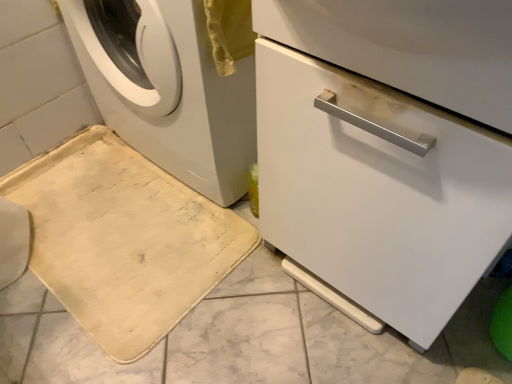
Locate an element on the screen. This screenshot has height=384, width=512. white matte washing machine at left is located at coordinates (168, 89).

From a real-world perspective, between beige fabric bath mat at lower left and white glossy dishwasher at center, who is vertically lower?

beige fabric bath mat at lower left.

Between beige fabric bath mat at lower left and white glossy dishwasher at center, which one is positioned behind?

beige fabric bath mat at lower left.

Based on the photo, is beige fabric bath mat at lower left to the left of white glossy dishwasher at center from the viewer's perspective?

Yes, beige fabric bath mat at lower left is to the left of white glossy dishwasher at center.

Is beige fabric bath mat at lower left completely or partially outside of white glossy dishwasher at center?

Yes, beige fabric bath mat at lower left is not within white glossy dishwasher at center.

This screenshot has width=512, height=384. Identify the location of washing machine that appears above the beige fabric bath mat at lower left (from the image's perspective). (168, 89).

From a real-world perspective, relative to beige fabric bath mat at lower left, is white matte washing machine at left vertically above or below?

In terms of real-world spatial position, white matte washing machine at left is above beige fabric bath mat at lower left.

In the image, is white matte washing machine at left on the left side or the right side of beige fabric bath mat at lower left?

From the image, it's evident that white matte washing machine at left is to the right of beige fabric bath mat at lower left.

From the image's perspective, between beige fabric bath mat at lower left and white matte washing machine at left, which one is located above?

white matte washing machine at left.

From a real-world perspective, between beige fabric bath mat at lower left and white matte washing machine at left, who is vertically lower?

beige fabric bath mat at lower left, from a real-world perspective.

Identify the location of washing machine that is in front of the beige fabric bath mat at lower left. Image resolution: width=512 pixels, height=384 pixels. (168, 89).

Based on the photo, is beige fabric bath mat at lower left situated inside white matte washing machine at left or outside?

beige fabric bath mat at lower left is located beyond the bounds of white matte washing machine at left.

Consider the image. Can you confirm if white matte washing machine at left is wider than white glossy dishwasher at center?

Yes.

Identify the location of machine that appears in front of the white matte washing machine at left. (387, 150).

Considering the relative positions of white matte washing machine at left and white glossy dishwasher at center in the image provided, is white matte washing machine at left to the left or to the right of white glossy dishwasher at center?

Clearly, white matte washing machine at left is on the left of white glossy dishwasher at center in the image.

Is there a large distance between white matte washing machine at left and white glossy dishwasher at center?

white matte washing machine at left is near white glossy dishwasher at center, not far away.

Is white glossy dishwasher at center not inside beige fabric bath mat at lower left?

That's correct, white glossy dishwasher at center is outside of beige fabric bath mat at lower left.

Is there a large distance between white glossy dishwasher at center and beige fabric bath mat at lower left?

They are positioned close to each other.

Does point (378, 276) come closer to viewer compared to point (29, 210)?

Yes, it is.

Is white glossy dishwasher at center wider than beige fabric bath mat at lower left?

Incorrect, the width of white glossy dishwasher at center does not surpass that of beige fabric bath mat at lower left.

Is white glossy dishwasher at center to the left of white matte washing machine at left from the viewer's perspective?

Incorrect, white glossy dishwasher at center is not on the left side of white matte washing machine at left.

Is white matte washing machine at left located within white glossy dishwasher at center?

No, white matte washing machine at left is not surrounded by white glossy dishwasher at center.

The height and width of the screenshot is (384, 512). What are the coordinates of `machine above the beige fabric bath mat at lower left (from the image's perspective)` in the screenshot? It's located at (387, 150).

Find the location of `washing machine above the beige fabric bath mat at lower left (from a real-world perspective)`. washing machine above the beige fabric bath mat at lower left (from a real-world perspective) is located at coordinates 168,89.

Based on the photo, estimate the real-world distances between objects in this image. Which object is closer to white glossy dishwasher at center, beige fabric bath mat at lower left or white matte washing machine at left?

The object closer to white glossy dishwasher at center is white matte washing machine at left.

Estimate the real-world distances between objects in this image. Which object is further from white matte washing machine at left, beige fabric bath mat at lower left or white glossy dishwasher at center?

white glossy dishwasher at center is further to white matte washing machine at left.

Based on their spatial positions, is white glossy dishwasher at center or white matte washing machine at left closer to beige fabric bath mat at lower left?

white matte washing machine at left is closer to beige fabric bath mat at lower left.

Looking at the image, which one is located closer to white glossy dishwasher at center, white matte washing machine at left or beige fabric bath mat at lower left?

white matte washing machine at left lies closer to white glossy dishwasher at center than the other object.

When comparing their distances from white matte washing machine at left, does white glossy dishwasher at center or beige fabric bath mat at lower left seem closer?

Result: beige fabric bath mat at lower left.

Estimate the real-world distances between objects in this image. Which object is further from beige fabric bath mat at lower left, white matte washing machine at left or white glossy dishwasher at center?

white glossy dishwasher at center is further to beige fabric bath mat at lower left.

Locate an element on the screen. The width and height of the screenshot is (512, 384). washing machine situated between beige fabric bath mat at lower left and white glossy dishwasher at center from left to right is located at coordinates (168, 89).